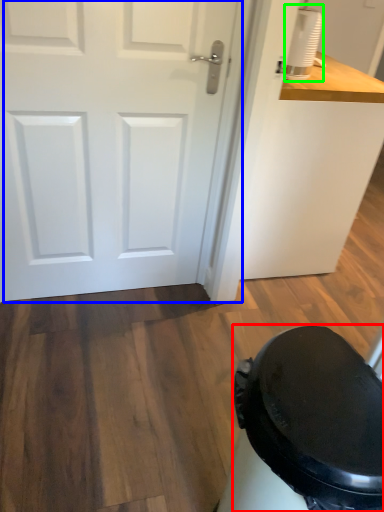
Question: Based on their relative distances, which object is farther from potty (highlighted by a red box)? Choose from door (highlighted by a blue box) and appliance (highlighted by a green box).

Choices:
 (A) door
 (B) appliance

Answer: (B)